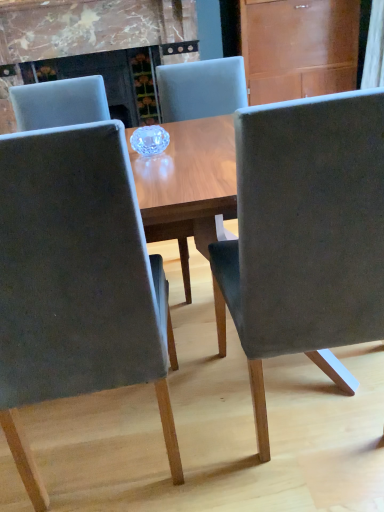
This screenshot has height=512, width=384. In order to click on vacant space underneath suede-like gray chair at center, marked as the third chair in a left-to-right arrangement (from a real-world perspective) in this screenshot , I will do pyautogui.click(x=310, y=411).